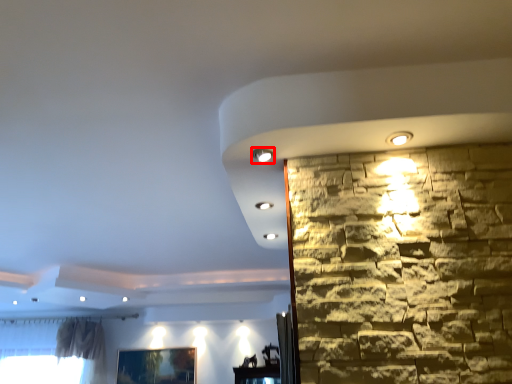
Question: Considering the relative positions of light (annotated by the red box) and picture frame in the image provided, where is light (annotated by the red box) located with respect to the staircase?

Choices:
 (A) left
 (B) right

Answer: (B)